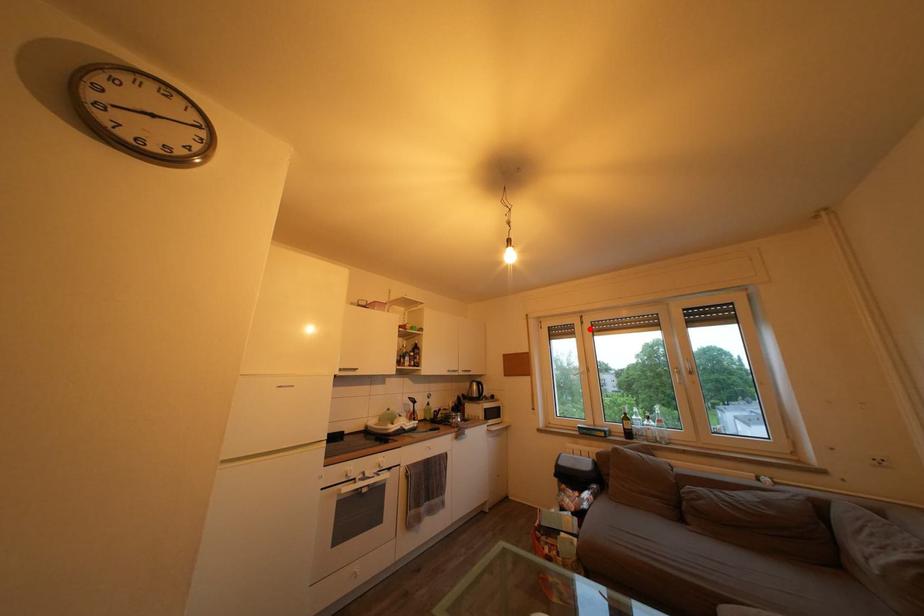
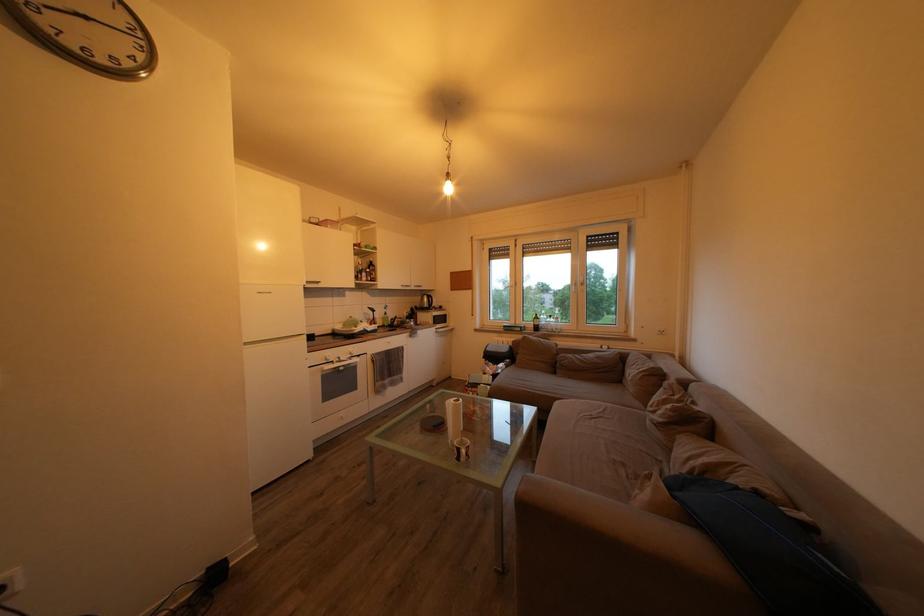
Question: I am providing you with two images of the same scene from different viewpoints. Image1 has a red point marked. In image2, the corresponding 3D location appears at what relative position? Reply with the corresponding letter.

Choices:
 (A) Closer
 (B) Farther

Answer: (A)